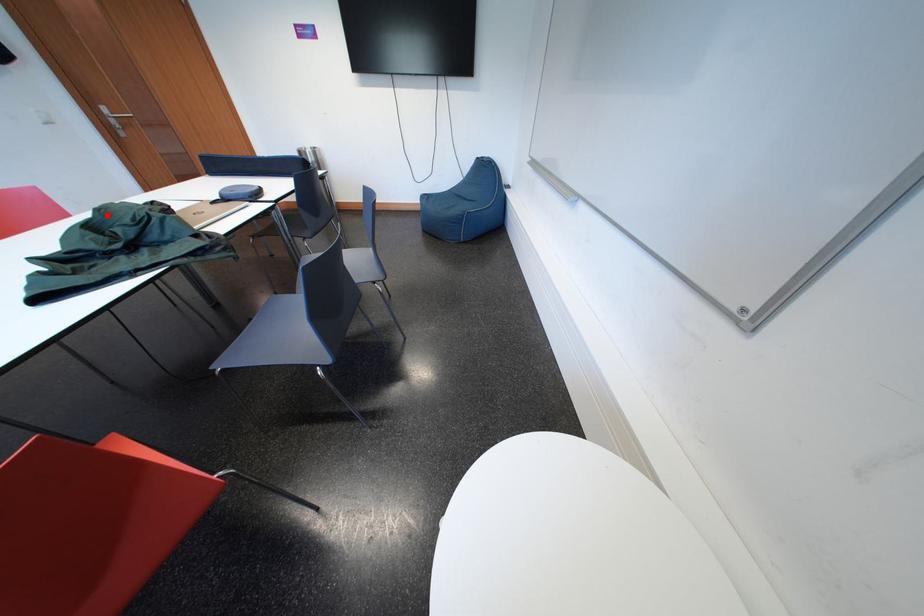
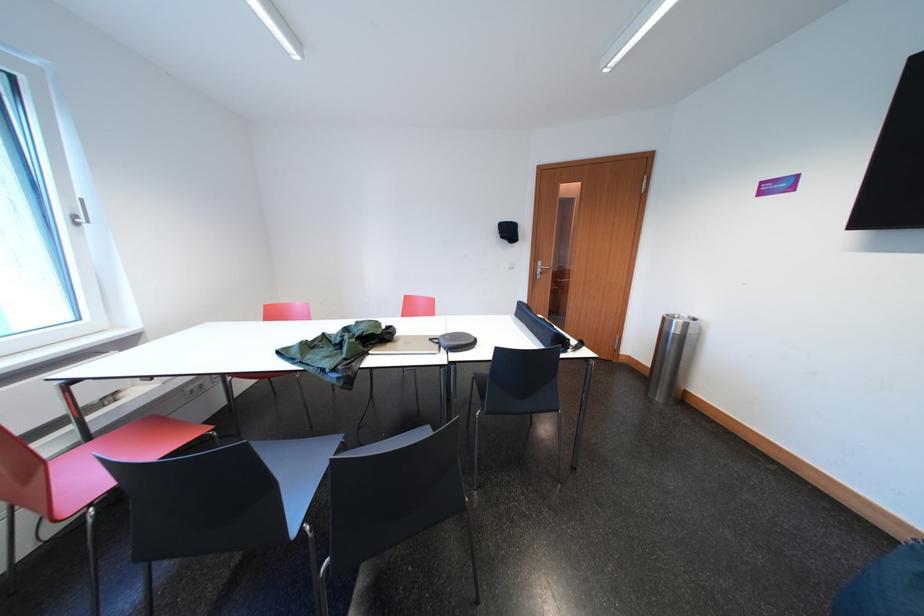
Find the pixel in the second image that matches the highlighted location in the first image.

(367, 326)